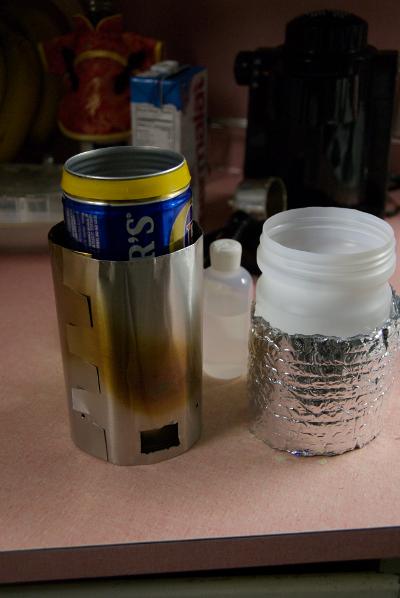
Locate an element on the screen. Image resolution: width=400 pixels, height=598 pixels. table top is located at coordinates (240, 489).